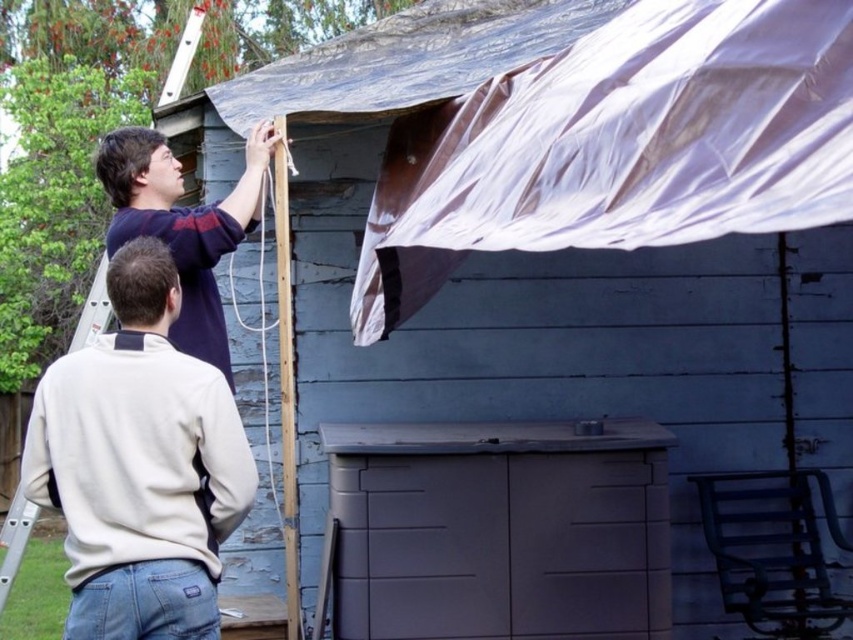
The image size is (853, 640). Describe the element at coordinates (138, 465) in the screenshot. I see `beige fleece sweatshirt at upper left` at that location.

Between beige fleece sweatshirt at upper left and matte blue shirt at upper left, which one is positioned lower?

beige fleece sweatshirt at upper left is lower down.

At what (x,y) coordinates should I click in order to perform the action: click on beige fleece sweatshirt at upper left. Please return your answer as a coordinate pair (x, y). The width and height of the screenshot is (853, 640). Looking at the image, I should click on (138, 465).